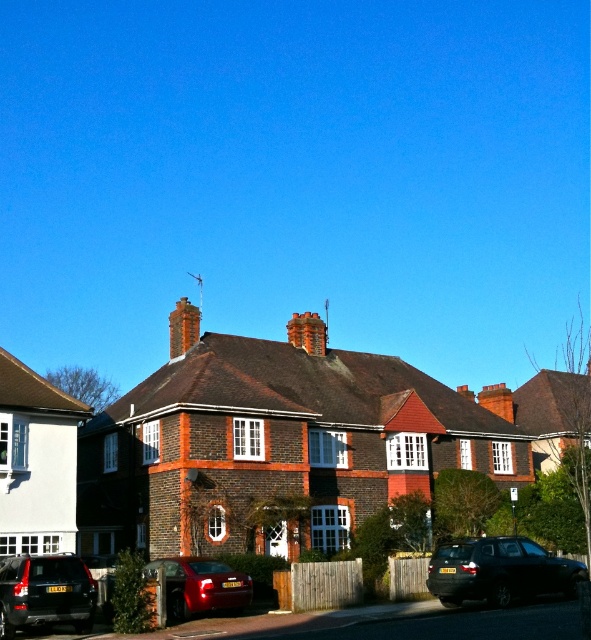
Question: Does matte black suv at lower left appear on the left side of metallic red car at lower center?

Choices:
 (A) yes
 (B) no

Answer: (A)

Question: Based on their relative distances, which object is nearer to the brick chimney at center?

Choices:
 (A) shiny black car at lower right
 (B) matte black suv at lower left

Answer: (B)

Question: Which point is farther to the camera?

Choices:
 (A) shiny black car at lower right
 (B) brick chimney at center

Answer: (B)

Question: Among these objects, which one is farthest from the camera?

Choices:
 (A) shiny black car at lower right
 (B) red brick chimney at center
 (C) matte black suv at lower left

Answer: (B)

Question: Can you confirm if brick chimney at center is thinner than red brick chimney at center?

Choices:
 (A) no
 (B) yes

Answer: (A)

Question: Can you confirm if matte black suv at lower left is bigger than red brick chimney at center?

Choices:
 (A) no
 (B) yes

Answer: (A)